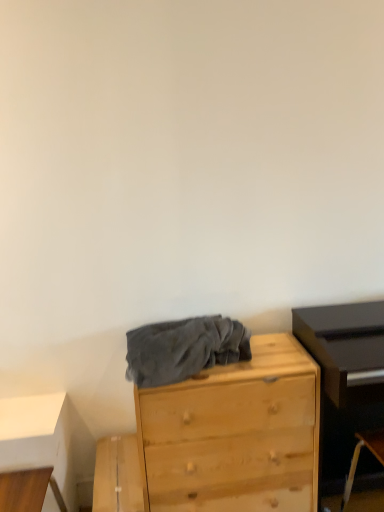
What is the approximate height of gray fleece blanket at center?

gray fleece blanket at center is 6.77 inches in height.

Describe the element at coordinates (183, 349) in the screenshot. I see `gray fleece blanket at center` at that location.

Describe the element at coordinates (235, 434) in the screenshot. Image resolution: width=384 pixels, height=512 pixels. I see `light wood chest of drawers at center` at that location.

Locate an element on the screen. gray fleece blanket at center is located at coordinates (183, 349).

From the image's perspective, is gray fleece blanket at center under light wood chest of drawers at center?

Actually, gray fleece blanket at center appears above light wood chest of drawers at center in the image.

Is gray fleece blanket at center wider or thinner than light wood chest of drawers at center?

Considering their sizes, gray fleece blanket at center looks slimmer than light wood chest of drawers at center.

Is gray fleece blanket at center turned away from light wood chest of drawers at center?

gray fleece blanket at center is not turned away from light wood chest of drawers at center.

At what (x,y) coordinates should I click in order to perform the action: click on clothing in front of the light wood chest of drawers at center. Please return your answer as a coordinate pair (x, y). Looking at the image, I should click on (183, 349).

Which object is more forward, light wood chest of drawers at center or gray fleece blanket at center?

gray fleece blanket at center is closer to the camera.

Between light wood chest of drawers at center and gray fleece blanket at center, which one appears on the left side from the viewer's perspective?

Positioned to the left is gray fleece blanket at center.

From a real-world perspective, between light wood chest of drawers at center and gray fleece blanket at center, who is vertically lower?

light wood chest of drawers at center is physically lower.

Is point (300, 463) positioned in front of point (249, 333)?

Yes.

Consider the image. Between gray fleece blanket at center and wooden table at lower left, which one has larger width?

gray fleece blanket at center.

Can you confirm if gray fleece blanket at center is positioned to the right of wooden table at lower left?

Indeed, gray fleece blanket at center is positioned on the right side of wooden table at lower left.

From a real-world perspective, which is physically below, gray fleece blanket at center or wooden table at lower left?

wooden table at lower left is physically lower.

I want to click on clothing lying above the wooden table at lower left (from the image's perspective), so click(x=183, y=349).

Is wooden table at lower left at the back of light wood chest of drawers at center?

No, light wood chest of drawers at center is not facing away from wooden table at lower left.

This screenshot has width=384, height=512. Find the location of `chest of drawers above the wooden table at lower left (from a real-world perspective)`. chest of drawers above the wooden table at lower left (from a real-world perspective) is located at coordinates (235, 434).

Would you say light wood chest of drawers at center is to the left or to the right of wooden table at lower left in the picture?

Based on their positions, light wood chest of drawers at center is located to the right of wooden table at lower left.

Is point (229, 433) closer to viewer compared to point (13, 454)?

No, (229, 433) is behind (13, 454).

This screenshot has height=512, width=384. What are the coordinates of `clothing that appears on the right of wooden table at lower left` in the screenshot? It's located at (183, 349).

What's the angular difference between wooden table at lower left and gray fleece blanket at center's facing directions?

The angular difference between wooden table at lower left and gray fleece blanket at center is 0.000519 degrees.

From a real-world perspective, between wooden table at lower left and gray fleece blanket at center, who is vertically lower?

In real-world perspective, wooden table at lower left is lower.

Which object is wider, wooden table at lower left or gray fleece blanket at center?

gray fleece blanket at center is wider.

Does wooden table at lower left turn towards light wood chest of drawers at center?

No.

From the image's perspective, which object appears higher, wooden table at lower left or light wood chest of drawers at center?

light wood chest of drawers at center appears higher in the image.

Can we say wooden table at lower left lies outside light wood chest of drawers at center?

Yes, wooden table at lower left is not within light wood chest of drawers at center.

Does wooden table at lower left have a smaller size compared to light wood chest of drawers at center?

Indeed, wooden table at lower left has a smaller size compared to light wood chest of drawers at center.

The height and width of the screenshot is (512, 384). Find the location of `the chest of drawers that is under the gray fleece blanket at center (from a real-world perspective)`. the chest of drawers that is under the gray fleece blanket at center (from a real-world perspective) is located at coordinates click(x=235, y=434).

Find the location of `clothing lying above the light wood chest of drawers at center (from the image's perspective)`. clothing lying above the light wood chest of drawers at center (from the image's perspective) is located at coordinates (183, 349).

When comparing their distances from gray fleece blanket at center, does wooden table at lower left or light wood chest of drawers at center seem further?

Based on the image, wooden table at lower left appears to be further to gray fleece blanket at center.

Considering their positions, is light wood chest of drawers at center positioned closer to wooden table at lower left than gray fleece blanket at center?

Among the two, gray fleece blanket at center is located nearer to wooden table at lower left.

Which object lies nearer to the anchor point gray fleece blanket at center, light wood chest of drawers at center or wooden table at lower left?

light wood chest of drawers at center.

When comparing their distances from wooden table at lower left, does gray fleece blanket at center or light wood chest of drawers at center seem further?

Among the two, light wood chest of drawers at center is located further to wooden table at lower left.

From the image, which object appears to be nearer to light wood chest of drawers at center, wooden table at lower left or gray fleece blanket at center?

gray fleece blanket at center is closer to light wood chest of drawers at center.

Looking at the image, which one is located further to light wood chest of drawers at center, gray fleece blanket at center or wooden table at lower left?

Among the two, wooden table at lower left is located further to light wood chest of drawers at center.

Locate an element on the screen. clothing between wooden table at lower left and light wood chest of drawers at center from left to right is located at coordinates tap(183, 349).